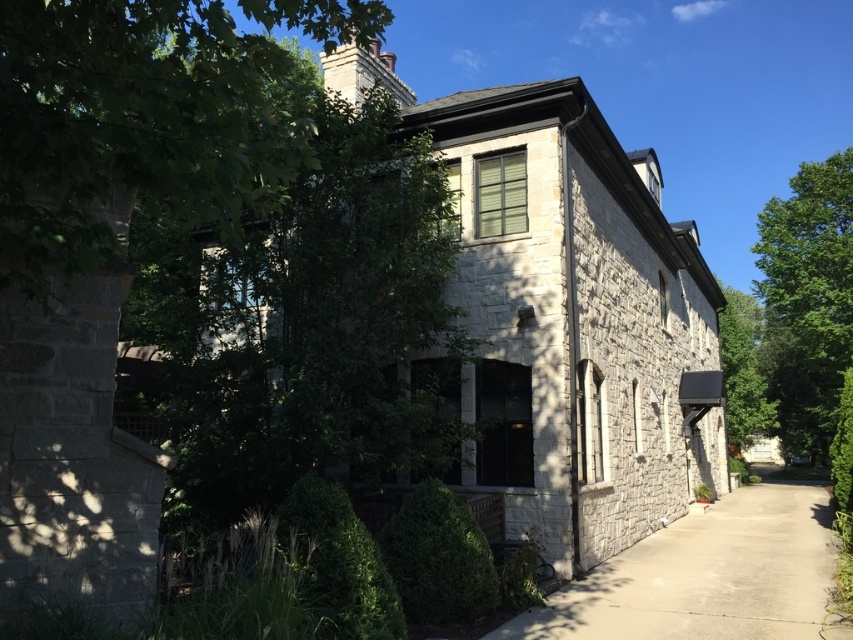
You are standing at the entrance of the two story stone building and want to walk to the green leafy tree at right. Which direction should you move relative to the concrete at lower right?

The concrete at lower right is in front of the green leafy tree at right, so you should move towards the concrete at lower right to reach the green leafy tree at right.

You are standing at the entrance of the two story stone building and want to know which object is smaller between the green leafy tree at left and the concrete at lower right. Can you tell me?

The green leafy tree at left is smaller than the concrete at lower right.

You are standing at the entrance of the two story stone building and looking towards the green leafy tree at left and the green leafy tree at right. Which tree is taller?

The green leafy tree at left is not as tall as the green leafy tree at right, so the tree on the right is taller.